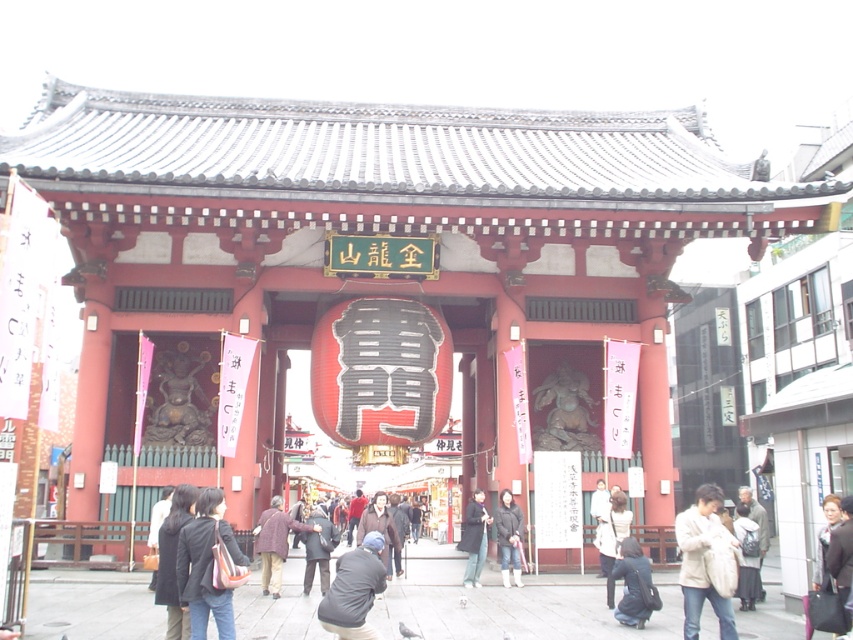
Looking at this image, is dark gray jacket at lower center bigger than white cotton jacket at lower center?

Indeed, dark gray jacket at lower center has a larger size compared to white cotton jacket at lower center.

Does point (322, 611) come farther from viewer compared to point (618, 531)?

No.

Where is `dark gray jacket at lower center`? dark gray jacket at lower center is located at coordinates (352, 589).

Image resolution: width=853 pixels, height=640 pixels. What do you see at coordinates (631, 584) in the screenshot? I see `dark blue leather jacket at lower center` at bounding box center [631, 584].

Between dark blue leather jacket at lower center and matte black jacket at center, which one is positioned higher?

dark blue leather jacket at lower center

The width and height of the screenshot is (853, 640). I want to click on dark blue leather jacket at lower center, so click(631, 584).

Does brown wool coat at center lie behind dark gray fabric coat at center?

No, it is in front of dark gray fabric coat at center.

Is brown wool coat at center to the right of dark gray fabric coat at center from the viewer's perspective?

In fact, brown wool coat at center is to the left of dark gray fabric coat at center.

Which is in front, point (283, 536) or point (467, 509)?

Point (283, 536) is more forward.

Where is `brown wool coat at center`? This screenshot has width=853, height=640. brown wool coat at center is located at coordinates (276, 541).